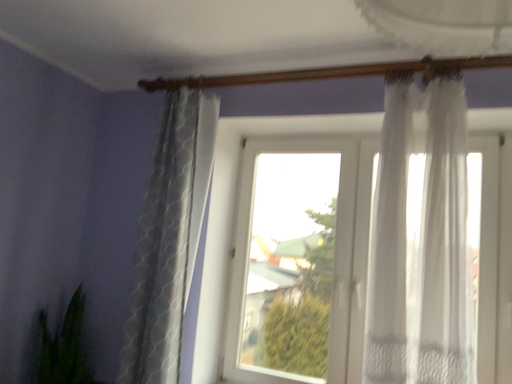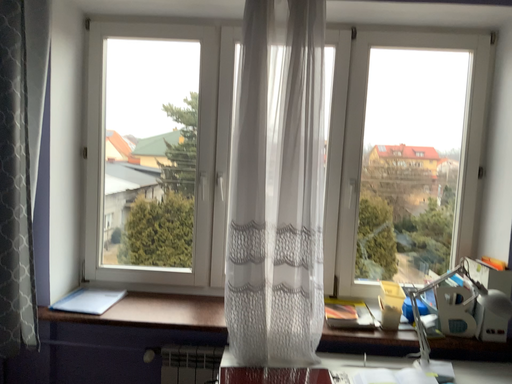
Question: Which way did the camera rotate in the video?

Choices:
 (A) rotated right
 (B) rotated left

Answer: (A)